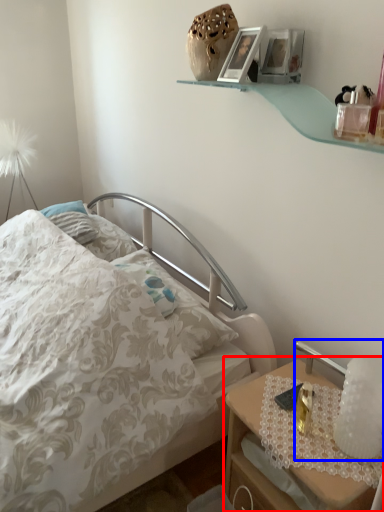
Question: Which of the following is the closest to the observer, nightstand (highlighted by a red box) or bedside lamp (highlighted by a blue box)?

Choices:
 (A) nightstand
 (B) bedside lamp

Answer: (A)